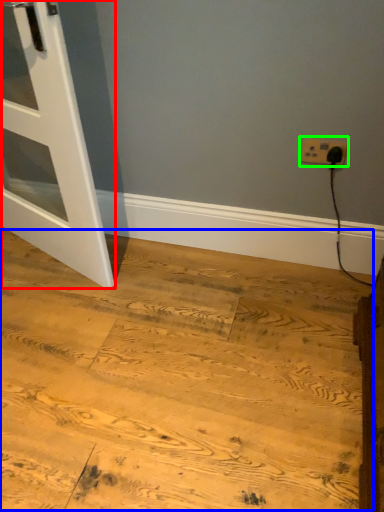
Question: Estimate the real-world distances between objects in this image. Which object is farther from door (highlighted by a red box), plywood (highlighted by a blue box) or power plugs and sockets (highlighted by a green box)?

Choices:
 (A) plywood
 (B) power plugs and sockets

Answer: (B)